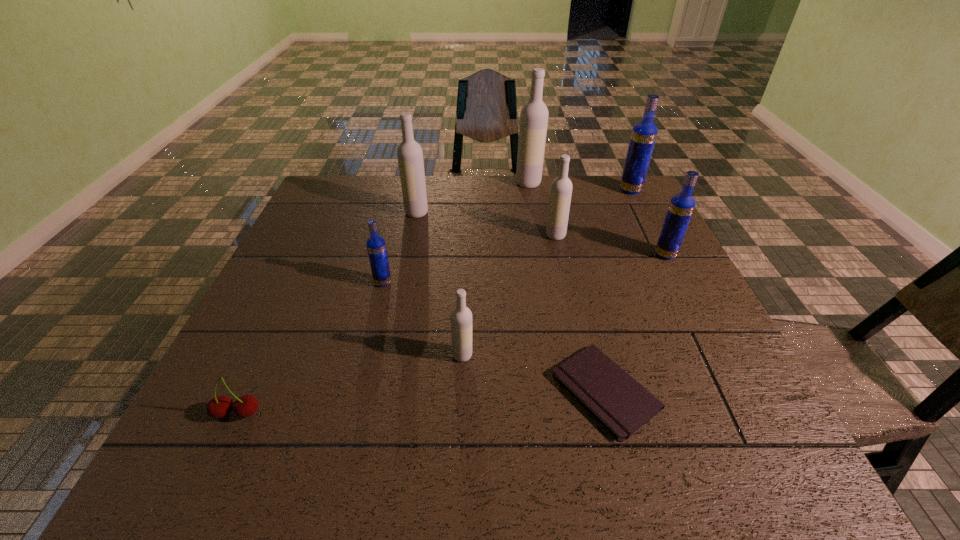
Identify the location of the biggest white vodka. This screenshot has width=960, height=540. (534, 115).

Locate an element on the screen. This screenshot has width=960, height=540. the farthest white vodka is located at coordinates (534, 115).

Find the location of `the farthest blue vodka`. the farthest blue vodka is located at coordinates (644, 133).

The width and height of the screenshot is (960, 540). In order to click on the third nearest white vodka in this screenshot , I will do `click(410, 155)`.

At what (x,y) coordinates should I click in order to perform the action: click on the seventh nearest object. Please return your answer as a coordinate pair (x, y). Image resolution: width=960 pixels, height=540 pixels. Looking at the image, I should click on (410, 155).

Locate an element on the screen. The image size is (960, 540). the sixth nearest object is located at coordinates (561, 187).

I want to click on the fourth nearest vodka, so click(x=561, y=187).

Identify the location of the fifth farthest object. (681, 206).

Where is `the second farthest blue vodka`? The height and width of the screenshot is (540, 960). the second farthest blue vodka is located at coordinates tap(681, 206).

Find the location of a particular element. The width and height of the screenshot is (960, 540). the leftmost blue vodka is located at coordinates (376, 247).